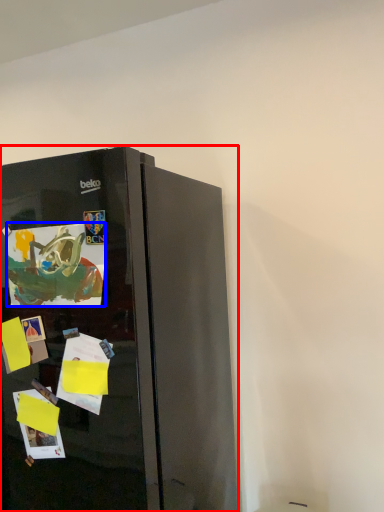
Question: Among these objects, which one is farthest to the camera, refrigerator (highlighted by a red box) or postcard (highlighted by a blue box)?

Choices:
 (A) refrigerator
 (B) postcard

Answer: (B)